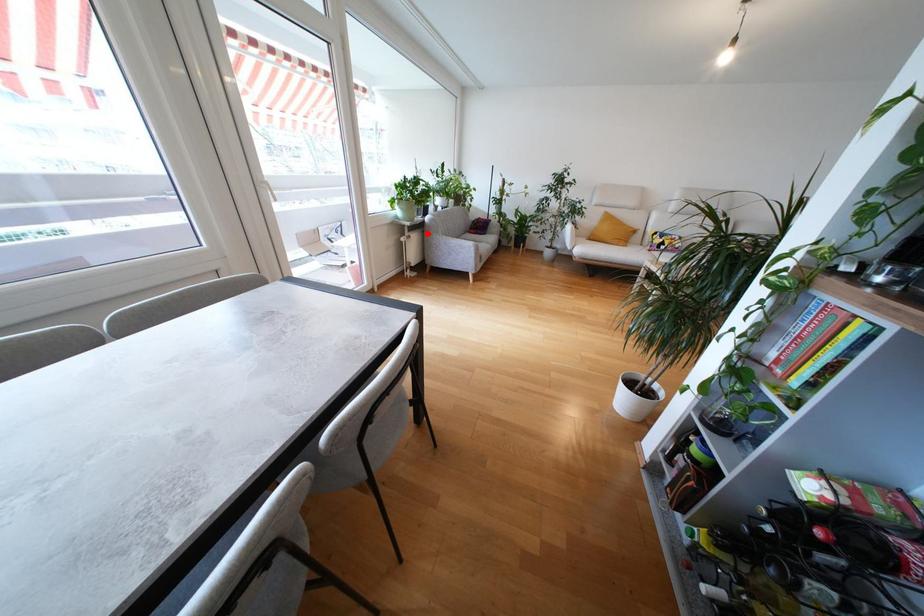
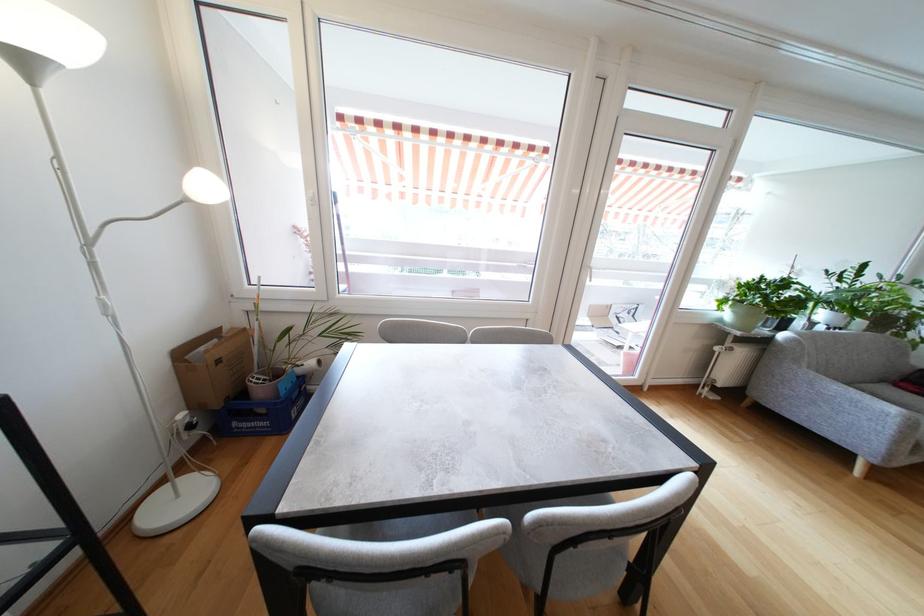
Question: I am providing you with two images of the same scene from different viewpoints. A red point is shown in image1. For the corresponding object point in image2, is it positioned nearer or farther from the camera?

Choices:
 (A) Nearer
 (B) Farther

Answer: (B)